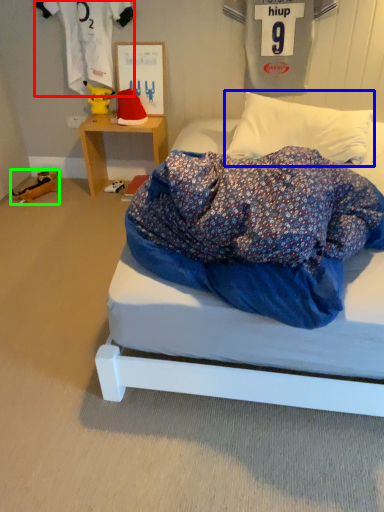
Question: Which object is positioned closest to clothing (highlighted by a red box)? Select from pillow (highlighted by a blue box) and toy (highlighted by a green box).

Choices:
 (A) pillow
 (B) toy

Answer: (B)